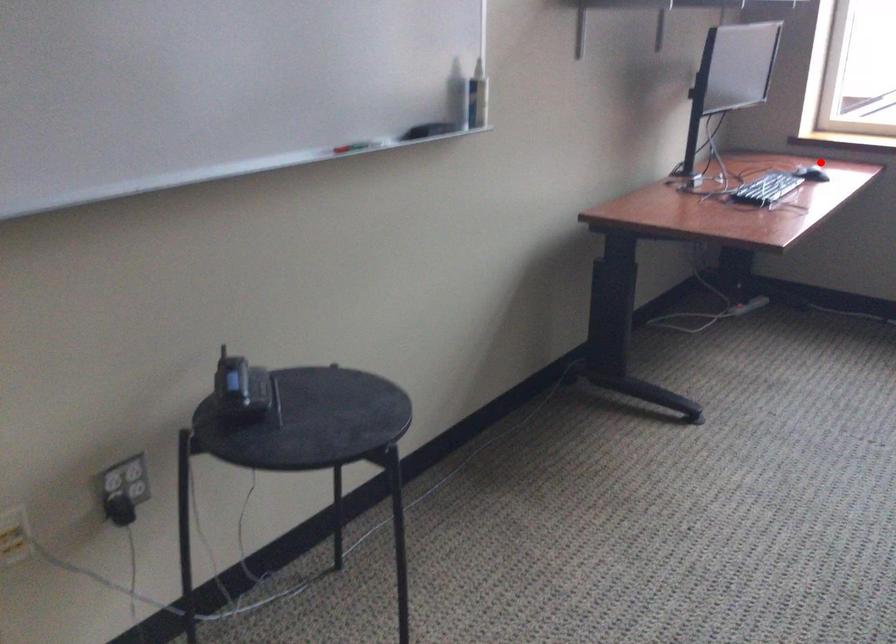
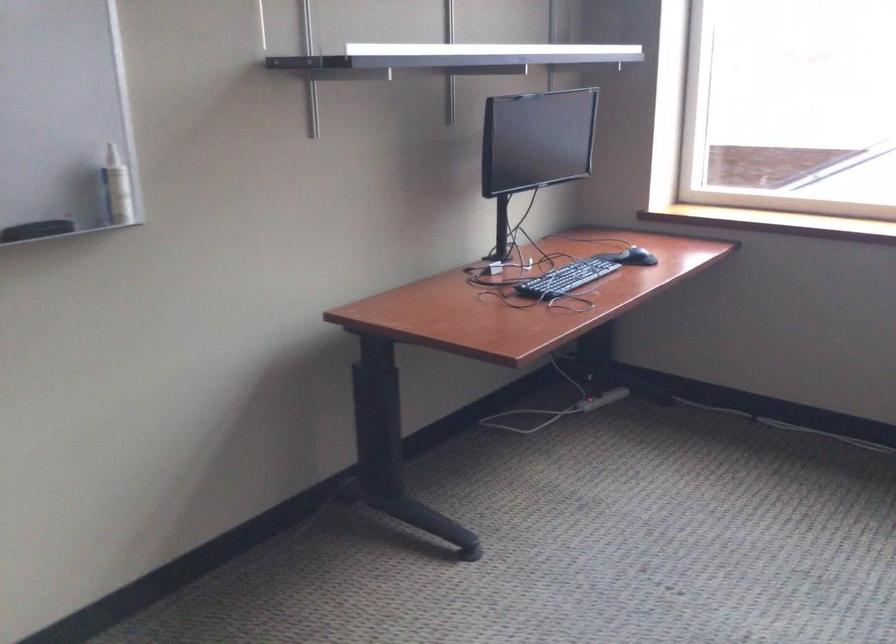
Where in the second image is the point corresponding to the highlighted location from the first image?

(636, 257)